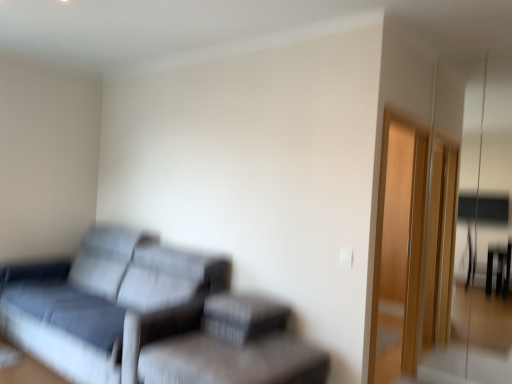
Question: From the image's perspective, is textured gray swivel chair at lower center located above transparent glass door at right?

Choices:
 (A) yes
 (B) no

Answer: (B)

Question: Considering the relative sizes of textured gray swivel chair at lower center and transparent glass door at right in the image provided, is textured gray swivel chair at lower center shorter than transparent glass door at right?

Choices:
 (A) yes
 (B) no

Answer: (A)

Question: Is textured gray swivel chair at lower center further to the viewer compared to transparent glass door at right?

Choices:
 (A) yes
 (B) no

Answer: (B)

Question: Is textured gray swivel chair at lower center oriented away from transparent glass door at right?

Choices:
 (A) yes
 (B) no

Answer: (B)

Question: From a real-world perspective, is textured gray swivel chair at lower center physically below transparent glass door at right?

Choices:
 (A) yes
 (B) no

Answer: (A)

Question: Can you confirm if textured gray swivel chair at lower center is wider than transparent glass door at right?

Choices:
 (A) yes
 (B) no

Answer: (A)

Question: Is transparent glass door at right surrounding textured gray swivel chair at lower center?

Choices:
 (A) yes
 (B) no

Answer: (B)

Question: Is transparent glass door at right to the left of textured gray swivel chair at lower center from the viewer's perspective?

Choices:
 (A) yes
 (B) no

Answer: (B)

Question: From the image's perspective, is transparent glass door at right on textured gray swivel chair at lower center?

Choices:
 (A) yes
 (B) no

Answer: (A)

Question: From a real-world perspective, is transparent glass door at right under textured gray swivel chair at lower center?

Choices:
 (A) no
 (B) yes

Answer: (A)

Question: Is transparent glass door at right taller than textured gray swivel chair at lower center?

Choices:
 (A) no
 (B) yes

Answer: (B)

Question: Is there a large distance between transparent glass door at right and textured gray swivel chair at lower center?

Choices:
 (A) yes
 (B) no

Answer: (A)

Question: Does textured gray couch at left have a greater height compared to textured fabric footrest at lower center?

Choices:
 (A) yes
 (B) no

Answer: (A)